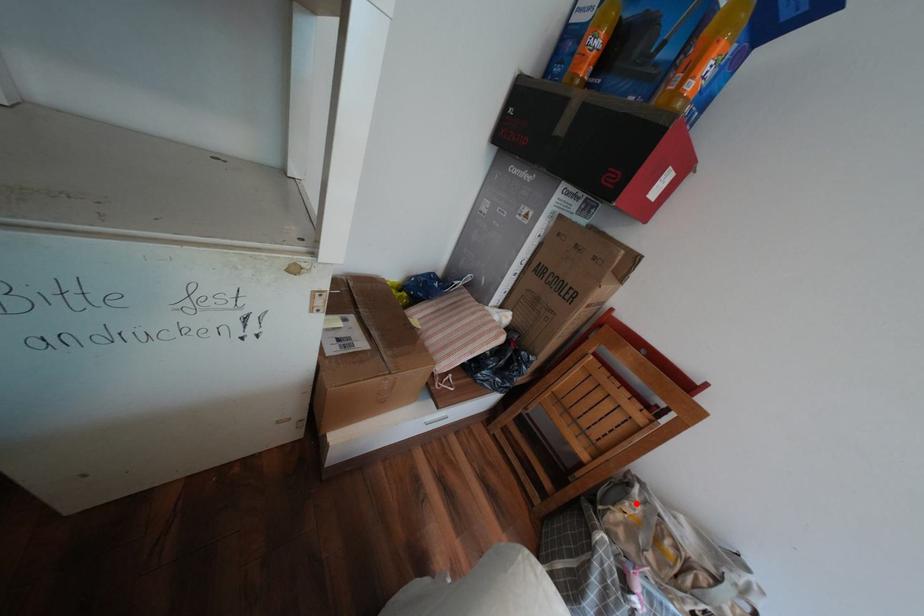
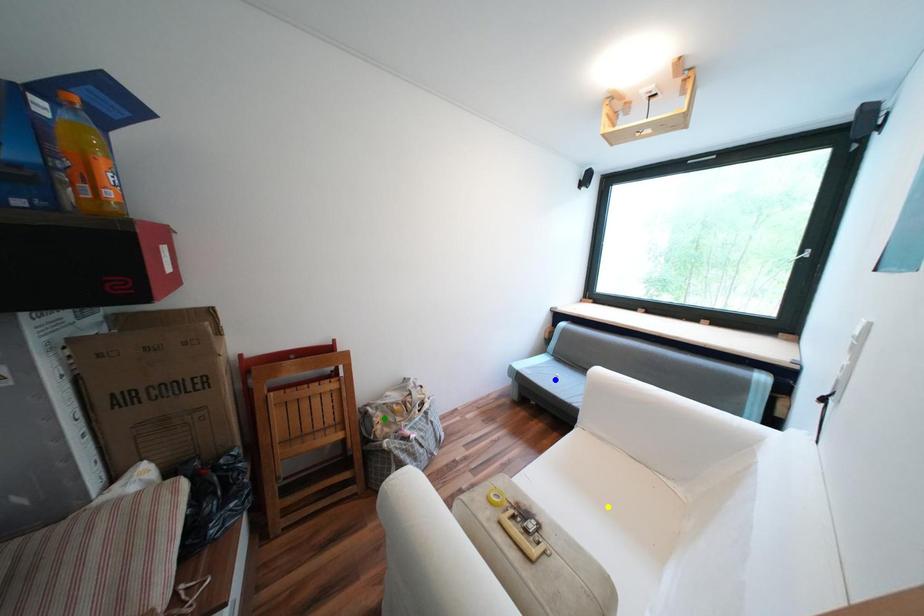
Question: I am providing you with two images of the same scene from different viewpoints. A red point is marked on the first image. You are given multiple points on the second image. Which mark in image 2 goes with the point in image 1?

Choices:
 (A) green point
 (B) yellow point
 (C) blue point

Answer: (A)